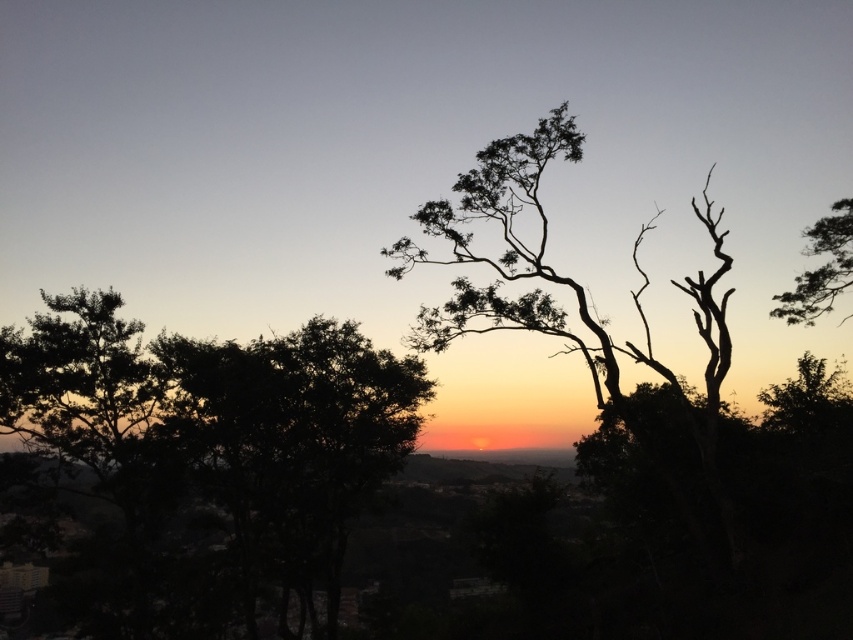
Consider the image. You are an artist trying to sketch the sunset scene. You want to ensure the dark green leafy tree at center and the silhouette bark tree at upper right are positioned correctly. Based on the scene description, which tree should you draw lower on your paper?

The dark green leafy tree at center should be drawn lower on the paper because it is positioned below the silhouette bark tree at upper right according to the description.